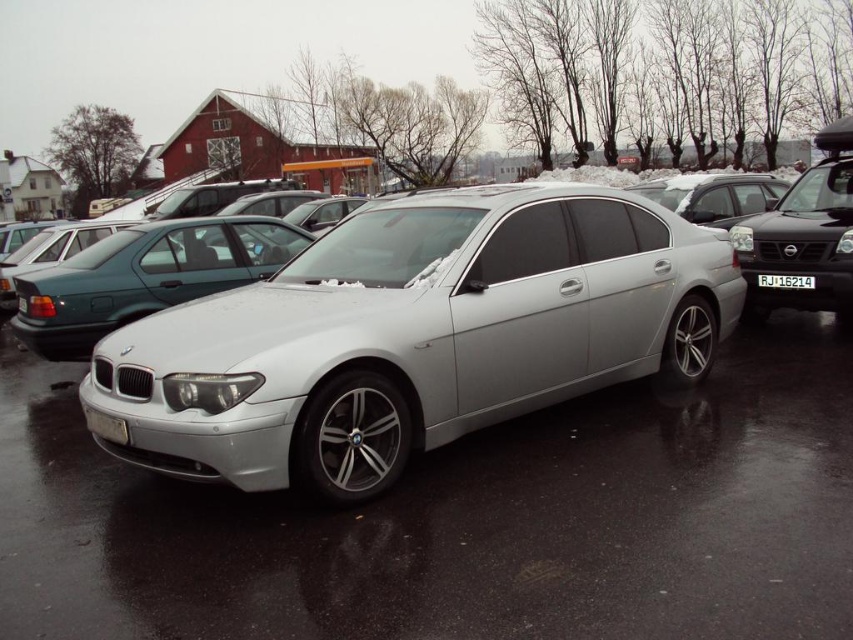
You are a delivery driver who needs to park your truck in the parking lot. The parking spot you want is marked by the point at coordinates (413, 337). What vehicle is currently occupying that spot?

The point at coordinates (413, 337) indicates the satin silver sedan at center, so the satin silver sedan at center is occupying that parking spot.

You are a delivery driver who needs to park your truck in this parking lot. You see the satin silver sedan at center and the white plastic license plate at center. Which object is positioned lower in the image?

The satin silver sedan at center is located below the white plastic license plate at center, so the sedan is positioned lower in the image.